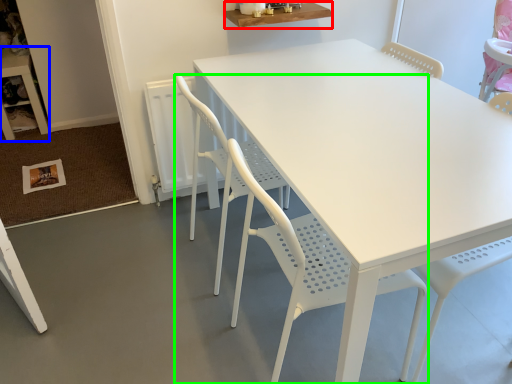
Question: Considering the real-world distances, which object is closest to table (highlighted by a red box)? table (highlighted by a blue box) or chair (highlighted by a green box).

Choices:
 (A) table
 (B) chair

Answer: (B)